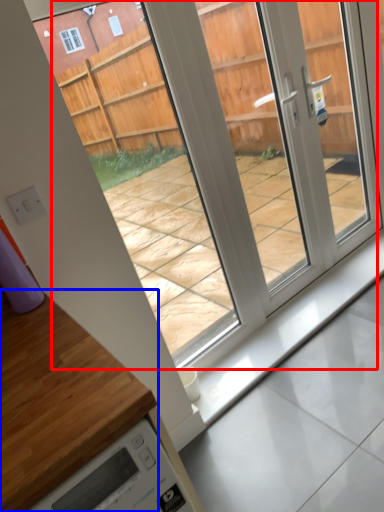
Question: Which object is further to the camera taking this photo, glass door (highlighted by a red box) or countertop (highlighted by a blue box)?

Choices:
 (A) glass door
 (B) countertop

Answer: (A)